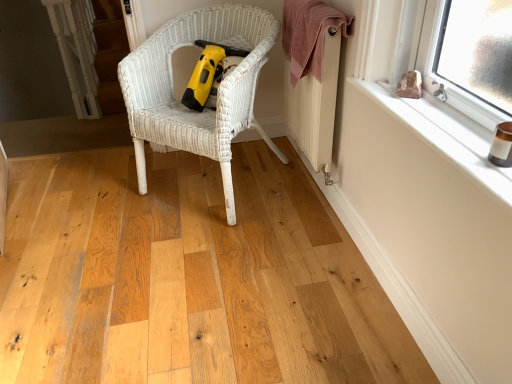
Where is `vacant area that lies in front of white wicker chair at center`? The width and height of the screenshot is (512, 384). vacant area that lies in front of white wicker chair at center is located at coordinates (188, 270).